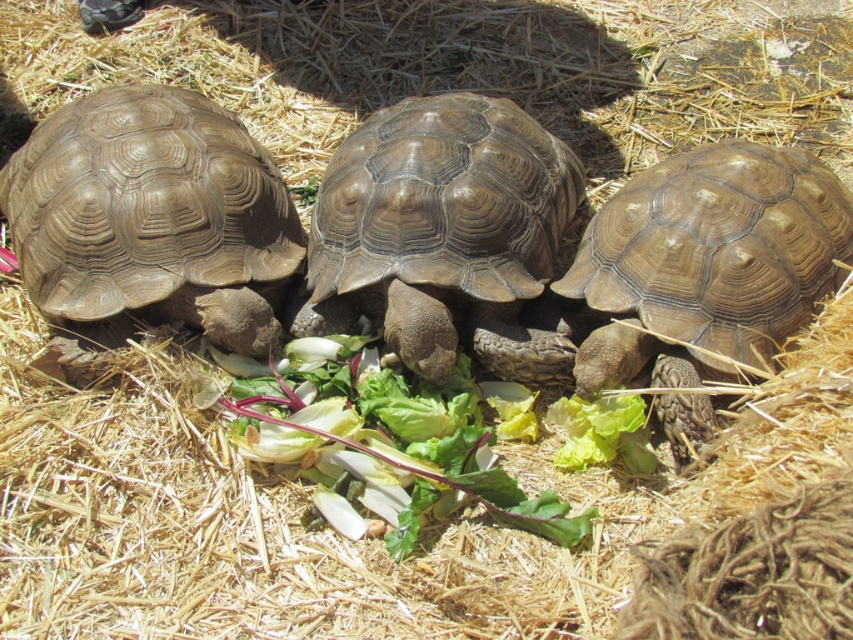
Question: Which of the following is the farthest from the observer?

Choices:
 (A) (737, 282)
 (B) (173, 276)
 (C) (270, 408)

Answer: (B)

Question: Which object is farther from the camera taking this photo?

Choices:
 (A) green leafy at center
 (B) brown textured tortoise at center
 (C) brown textured shell at left

Answer: (C)

Question: Is brown textured shell at left positioned behind matte brown tortoise at right?

Choices:
 (A) no
 (B) yes

Answer: (B)

Question: Is matte brown tortoise at right above green leafy at center?

Choices:
 (A) no
 (B) yes

Answer: (B)

Question: Can you confirm if brown textured shell at left is thinner than brown textured tortoise at center?

Choices:
 (A) no
 (B) yes

Answer: (A)

Question: Which point is closer to the camera?

Choices:
 (A) green leafy at center
 (B) matte brown tortoise at right

Answer: (A)